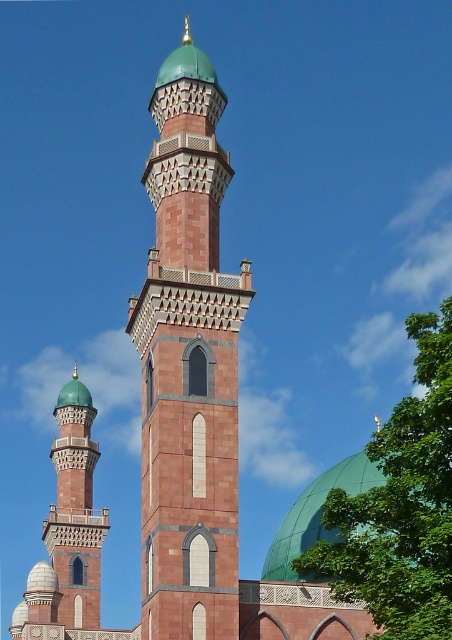
Question: Is reddish-brown stone minaret at center in front of matte red brick minaret at left?

Choices:
 (A) no
 (B) yes

Answer: (B)

Question: Which object is the closest to the green glossy dome at center?

Choices:
 (A) reddish-brown stone minaret at center
 (B) matte red brick minaret at left
 (C) green leafy tree at center right

Answer: (C)

Question: Considering the real-world distances, which object is closest to the green leafy tree at center right?

Choices:
 (A) green glossy dome at center
 (B) reddish-brown stone minaret at center
 (C) matte red brick minaret at left

Answer: (A)

Question: Which object appears closest to the camera in this image?

Choices:
 (A) reddish-brown stone minaret at center
 (B) green glossy dome at center

Answer: (B)

Question: Does green leafy tree at center right have a greater width compared to green glossy dome at center?

Choices:
 (A) no
 (B) yes

Answer: (B)

Question: Can you confirm if green leafy tree at center right is smaller than green glossy dome at center?

Choices:
 (A) yes
 (B) no

Answer: (B)